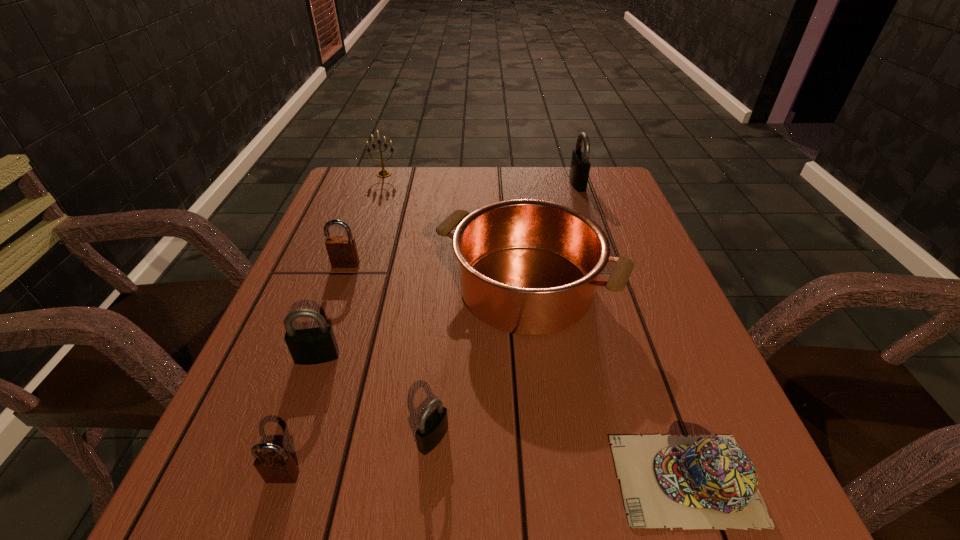
Identify the location of object that is the fifth closest to the second nearest padlock. click(342, 250).

Where is `padlock that is the closest one to the gold candelabrum`? The width and height of the screenshot is (960, 540). padlock that is the closest one to the gold candelabrum is located at coordinates (342, 250).

You are a GUI agent. You are given a task and a screenshot of the screen. Output one action in this format:
    pyautogui.click(x=<x>, y=<y>)
    Task: Click on the padlock that can be found as the fifth closest to the candelabrum
    This screenshot has width=960, height=540.
    Given the screenshot: What is the action you would take?
    pyautogui.click(x=274, y=467)

This screenshot has width=960, height=540. I want to click on black padlock object that ranks as the third closest to the fourth nearest padlock, so click(x=580, y=165).

Where is `the third closest black padlock to the gold candelabrum`? the third closest black padlock to the gold candelabrum is located at coordinates (432, 428).